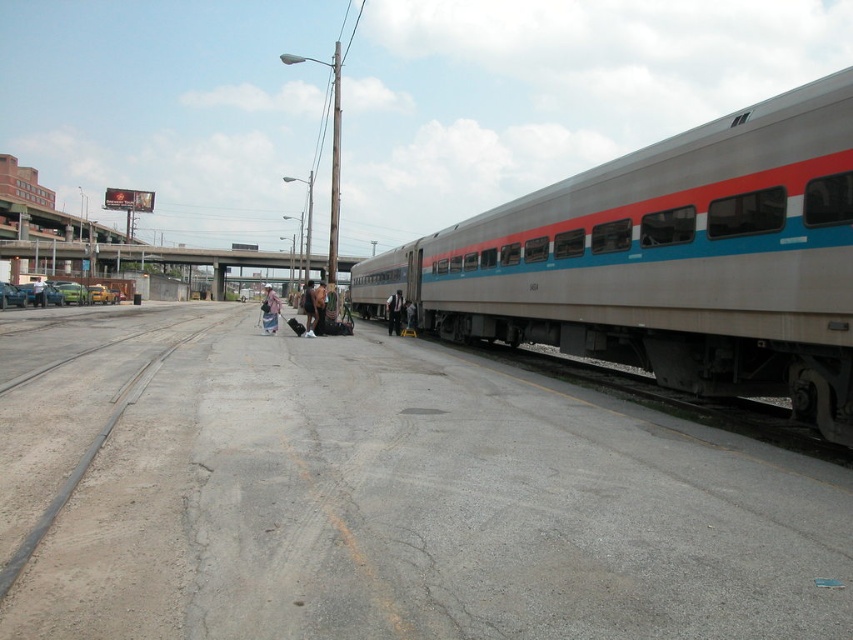
You are standing at the train station and want to take a photo of the two points mentioned. Which point, point (276,330) or point (398,324), will appear larger in your photo?

Point (276,330) will appear larger in the photo because it is closer to the camera than point (398,324).

Based on the photo, you are a fashion designer observing two jackets at a train station. You notice a light brown leather jacket at center and a dark brown leather jacket at center. Which jacket has a shorter length?

The light brown leather jacket at center is shorter than the dark brown leather jacket at center, so the light brown one has a shorter length.